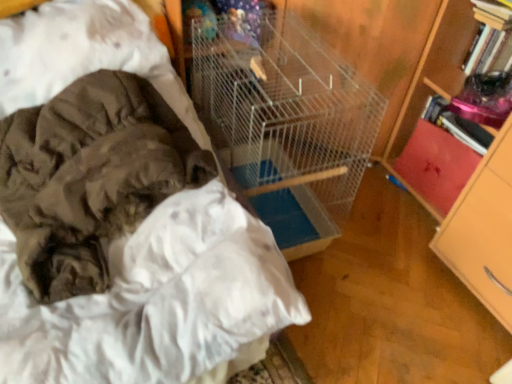
Question: Should I look upward or downward to see wooden bookcase at right?

Choices:
 (A) down
 (B) up

Answer: (B)

Question: Is white wire birdcage at center at the left side of red leather book at right, which appears as the second drawer when viewed from the front?

Choices:
 (A) yes
 (B) no

Answer: (A)

Question: Could you tell me if white wire birdcage at center is turned towards red leather book at right, placed as the 1th drawer when sorted from back to front?

Choices:
 (A) no
 (B) yes

Answer: (A)

Question: Is the depth of white wire birdcage at center less than that of red leather book at right, placed as the 1th drawer when sorted from back to front?

Choices:
 (A) no
 (B) yes

Answer: (B)

Question: Can you confirm if white wire birdcage at center is taller than red leather book at right, which appears as the second drawer when viewed from the front?

Choices:
 (A) yes
 (B) no

Answer: (A)

Question: Is white wire birdcage at center placed right next to red leather book at right, which appears as the second drawer when viewed from the front?

Choices:
 (A) no
 (B) yes

Answer: (A)

Question: From a real-world perspective, is white wire birdcage at center physically below red leather book at right, which appears as the second drawer when viewed from the front?

Choices:
 (A) no
 (B) yes

Answer: (A)

Question: From a real-world perspective, does red leather book at right, which appears as the second drawer when viewed from the front, sit lower than wooden drawer at right, the 1th drawer from the front?

Choices:
 (A) no
 (B) yes

Answer: (B)

Question: From a real-world perspective, is red leather book at right, which appears as the second drawer when viewed from the front, physically above wooden drawer at right, the 2th drawer from the back?

Choices:
 (A) yes
 (B) no

Answer: (B)

Question: Is red leather book at right, placed as the 1th drawer when sorted from back to front, at the right side of wooden drawer at right, the 1th drawer from the front?

Choices:
 (A) yes
 (B) no

Answer: (B)

Question: Are red leather book at right, which appears as the second drawer when viewed from the front, and wooden drawer at right, the 2th drawer from the back, far apart?

Choices:
 (A) no
 (B) yes

Answer: (A)

Question: Does red leather book at right, which appears as the second drawer when viewed from the front, have a smaller size compared to wooden drawer at right, the 1th drawer from the front?

Choices:
 (A) yes
 (B) no

Answer: (A)

Question: Is red leather book at right, placed as the 1th drawer when sorted from back to front, positioned with its back to wooden drawer at right, the 2th drawer from the back?

Choices:
 (A) no
 (B) yes

Answer: (A)

Question: Is white wire birdcage at center positioned behind wooden drawer at right, the 2th drawer from the back?

Choices:
 (A) no
 (B) yes

Answer: (B)